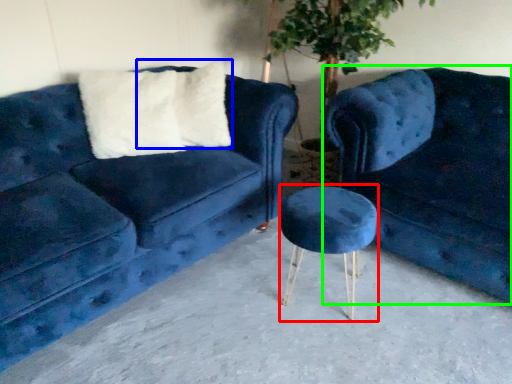
Question: Which is farther away from bar stool (highlighted by a red box)? pillow (highlighted by a blue box) or studio couch (highlighted by a green box)?

Choices:
 (A) pillow
 (B) studio couch

Answer: (A)